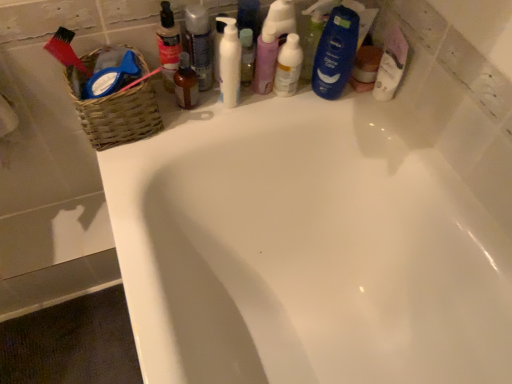
Locate an element on the screen. The image size is (512, 384). vacant region in front of brown glass bottle at upper center, the second toiletry from the left is located at coordinates (155, 143).